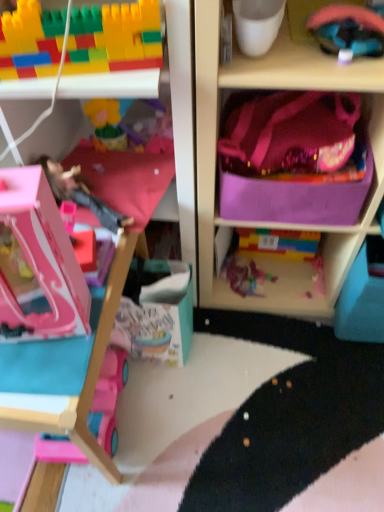
Locate an element on the screen. The image size is (384, 512). unoccupied region to the right of pink plastic toy car at lower left, the first toy positioned from the bottom is located at coordinates [x=172, y=421].